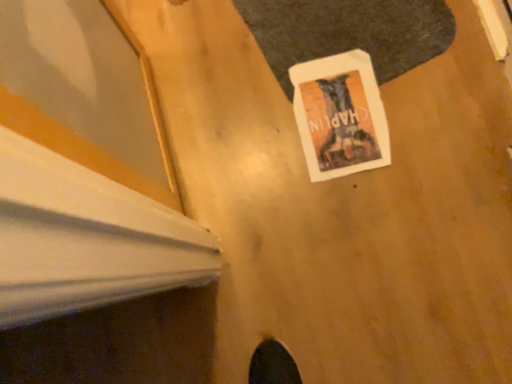
Question: Considering the positions of white paper at center and white paper at center in the image, is white paper at center wider or thinner than white paper at center?

Choices:
 (A) wide
 (B) thin

Answer: (B)

Question: Is white paper at center spatially inside white paper at center, or outside of it?

Choices:
 (A) outside
 (B) inside

Answer: (B)

Question: Relative to white paper at center, is white paper at center in front or behind?

Choices:
 (A) behind
 (B) front

Answer: (A)

Question: Is point (308, 36) closer or farther from the camera than point (309, 148)?

Choices:
 (A) farther
 (B) closer

Answer: (A)

Question: In terms of size, does white paper at center appear bigger or smaller than white paper at center?

Choices:
 (A) big
 (B) small

Answer: (A)

Question: From a real-world perspective, relative to white paper at center, is white paper at center vertically above or below?

Choices:
 (A) above
 (B) below

Answer: (A)

Question: Visually, is white paper at center positioned to the left or to the right of white paper at center?

Choices:
 (A) right
 (B) left

Answer: (A)